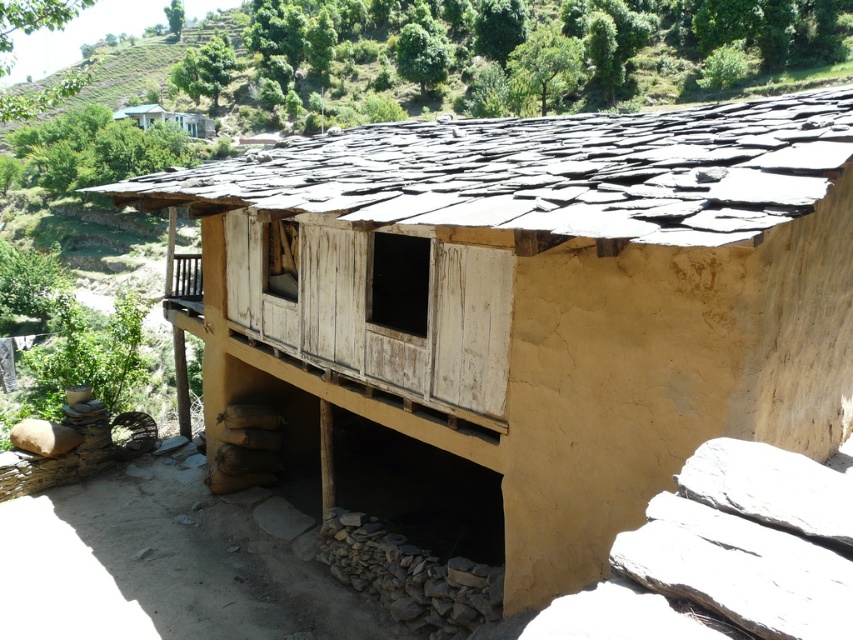
You are standing at the entrance of the rustic building and want to locate two specific points marked on a map. The first point is at coordinates point (558, 193) and the second is at point (123, 109). From your current position, which point is closer to you?

Point (558, 193) is closer to you because it is in front of point (123, 109).

You are standing at the base of the hill where the rustic structure is located. You notice the dark gray slate roof at upper center and the light blue wooden house at upper left. Which object is farther away from you?

The dark gray slate roof at upper center is 49.45 meters away from the light blue wooden house at upper left. Since you are at the base of the hill, the distance between the two objects suggests that the dark gray slate roof at upper center is farther away from you compared to the light blue wooden house at upper left.